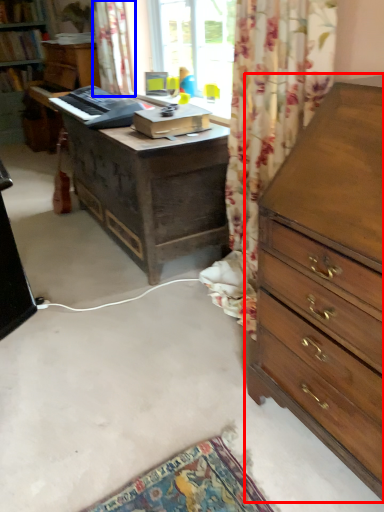
Question: Which object appears closest to the camera in this image, chest of drawers (highlighted by a red box) or curtain (highlighted by a blue box)?

Choices:
 (A) chest of drawers
 (B) curtain

Answer: (A)